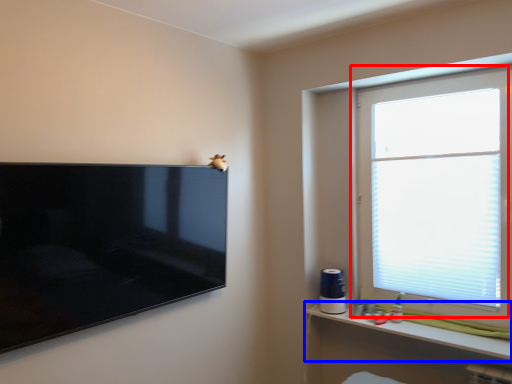
Question: Which object is closer to the camera taking this photo, window (highlighted by a red box) or shelf (highlighted by a blue box)?

Choices:
 (A) window
 (B) shelf

Answer: (B)